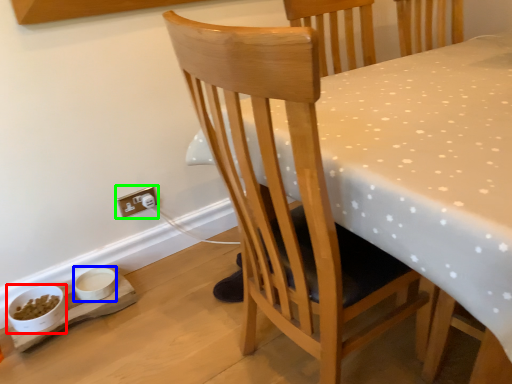
Question: Which object is the farthest from bowl (highlighted by a red box)? Choose among these: bowl (highlighted by a blue box) or electric outlet (highlighted by a green box).

Choices:
 (A) bowl
 (B) electric outlet

Answer: (B)